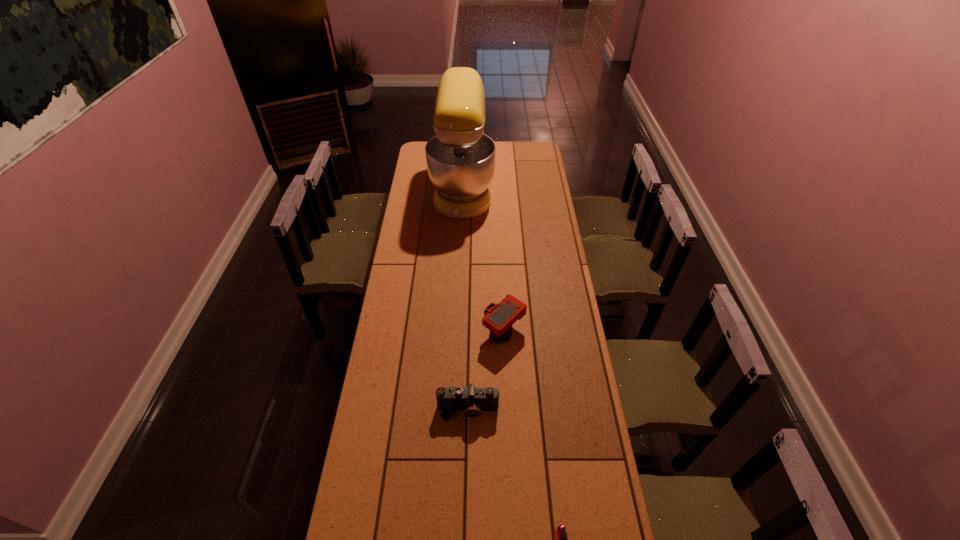
Identify which object is located as the second nearest to the farthest object. Please provide its 2D coordinates. Your answer should be formatted as a tuple, i.e. [(x, y)], where the tuple contains the x and y coordinates of a point satisfying the conditions above.

[(473, 400)]

Where is `camera that is the closest to the nearest object`? The height and width of the screenshot is (540, 960). camera that is the closest to the nearest object is located at coordinates (473, 400).

Where is `camera that is the closest one to the farthest camera`? Image resolution: width=960 pixels, height=540 pixels. camera that is the closest one to the farthest camera is located at coordinates (473, 400).

You are a GUI agent. You are given a task and a screenshot of the screen. Output one action in this format:
    pyautogui.click(x=<x>, y=<y>)
    Task: Click on the vacant space that satisfies the following two spatial constraints: 1. on the side of the third nearest object with the control knob; 2. on the right side of the farthest object
    
    Given the screenshot: What is the action you would take?
    pyautogui.click(x=456, y=332)

Find the location of a particular element. Image resolution: width=960 pixels, height=540 pixels. blank area in the image that satisfies the following two spatial constraints: 1. on the side of the third shortest object with the control knob; 2. on the left side of the mixer is located at coordinates (456, 332).

This screenshot has width=960, height=540. Find the location of `free space in the image that satisfies the following two spatial constraints: 1. on the side of the tallest camera with the control knob; 2. on the left side of the farthest object`. free space in the image that satisfies the following two spatial constraints: 1. on the side of the tallest camera with the control knob; 2. on the left side of the farthest object is located at coordinates (456, 332).

Identify the location of vacant space that satisfies the following two spatial constraints: 1. on the side of the tallest object with the control knob; 2. on the left side of the farthest camera. Image resolution: width=960 pixels, height=540 pixels. (456, 332).

At what (x,y) coordinates should I click in order to perform the action: click on vacant space that satisfies the following two spatial constraints: 1. on the side of the farthest camera with the control knob; 2. on the left side of the tallest object. Please return your answer as a coordinate pair (x, y). Looking at the image, I should click on (456, 332).